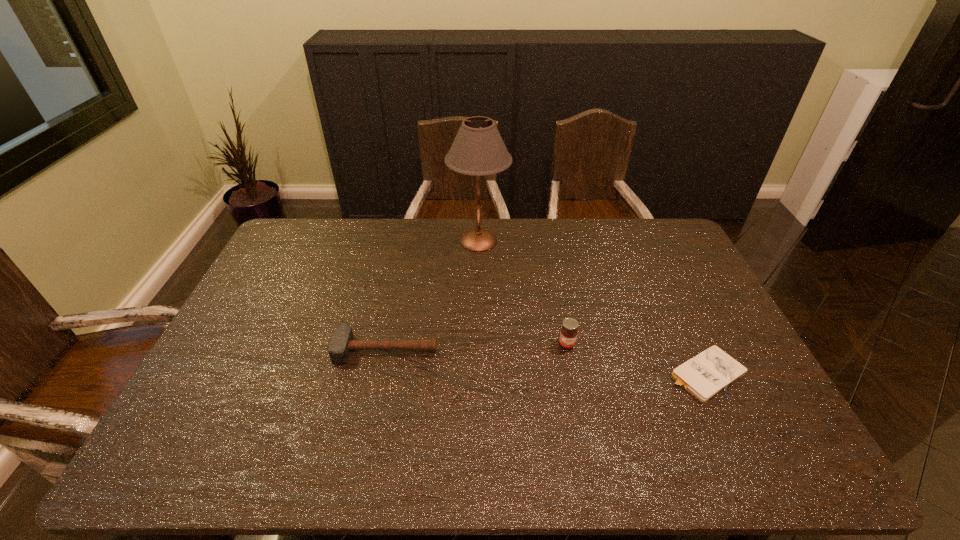
Where is `free point that satisfies the following two spatial constraints: 1. on the striking surface of the leftmost object; 2. on the right side of the shortest object`? This screenshot has width=960, height=540. free point that satisfies the following two spatial constraints: 1. on the striking surface of the leftmost object; 2. on the right side of the shortest object is located at coordinates (381, 374).

Locate an element on the screen. The height and width of the screenshot is (540, 960). vacant region that satisfies the following two spatial constraints: 1. on the striking surface of the hammer; 2. on the right side of the shortest object is located at coordinates (381, 374).

This screenshot has width=960, height=540. I want to click on vacant space that satisfies the following two spatial constraints: 1. on the striking surface of the shortest object; 2. on the right side of the hammer, so click(x=381, y=374).

Locate an element on the screen. blank space that satisfies the following two spatial constraints: 1. on the front-facing side of the farthest object; 2. on the back side of the shortest object is located at coordinates (478, 374).

The image size is (960, 540). In order to click on vacant area in the image that satisfies the following two spatial constraints: 1. on the striking surface of the second shortest object; 2. on the left side of the shortest object in this screenshot , I will do 381,374.

I want to click on free location that satisfies the following two spatial constraints: 1. on the label side of the jam; 2. on the right side of the shortest object, so click(x=572, y=374).

Image resolution: width=960 pixels, height=540 pixels. I want to click on free space that satisfies the following two spatial constraints: 1. on the striking surface of the leftmost object; 2. on the right side of the rightmost object, so click(x=381, y=374).

Identify the location of vacant space that satisfies the following two spatial constraints: 1. on the front-facing side of the table lamp; 2. on the left side of the notebook. (478, 374).

Where is `vacant space that satisfies the following two spatial constraints: 1. on the front-facing side of the farthest object; 2. on the back side of the notebook`? vacant space that satisfies the following two spatial constraints: 1. on the front-facing side of the farthest object; 2. on the back side of the notebook is located at coordinates (478, 374).

Identify the location of vacant space that satisfies the following two spatial constraints: 1. on the front-facing side of the farthest object; 2. on the striking surface of the third tallest object. The image size is (960, 540). (478, 348).